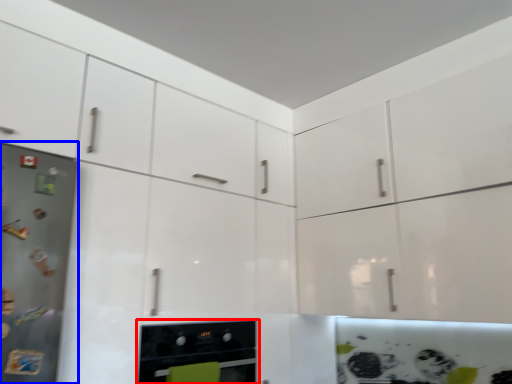
Question: Which of the following is the closest to the observer, home appliance (highlighted by a red box) or appliance (highlighted by a blue box)?

Choices:
 (A) home appliance
 (B) appliance

Answer: (B)